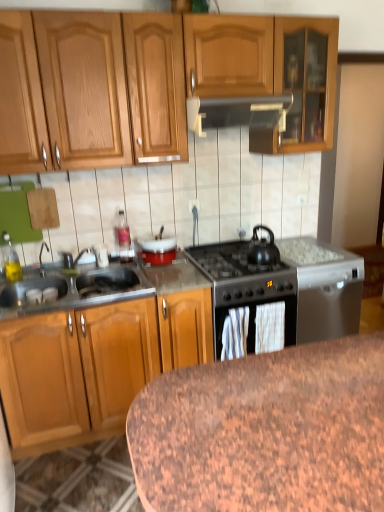
Question: Visually, is black matte tea pot at center-right positioned to the left or to the right of white glossy bowl at center, which ranks as the 2th appliance in left-to-right order?

Choices:
 (A) left
 (B) right

Answer: (B)

Question: In terms of width, does black matte tea pot at center-right look wider or thinner when compared to white glossy bowl at center, which ranks as the 2th appliance in right-to-left order?

Choices:
 (A) thin
 (B) wide

Answer: (A)

Question: Considering the real-world distances, which object is closest to the translucent glass bottle at upper center, the 1th appliance positioned from the left?

Choices:
 (A) granite table at lower center
 (B) brushed metal faucet at sink left
 (C) white glossy bowl at center, which ranks as the 2th appliance in left-to-right order
 (D) metallic gray dishwasher at right, which is counted as the 1th appliance, starting from the right
 (E) stainless steel sink at left

Answer: (C)

Question: Estimate the real-world distances between objects in this image. Which object is farther from the metallic gray dishwasher at right, which ranks as the 3th appliance in left-to-right order?

Choices:
 (A) stainless steel sink at left
 (B) metallic gray range hood at center
 (C) black matte tea pot at center-right
 (D) white glossy bowl at center, which ranks as the 2th appliance in left-to-right order
 (E) granite table at lower center

Answer: (E)